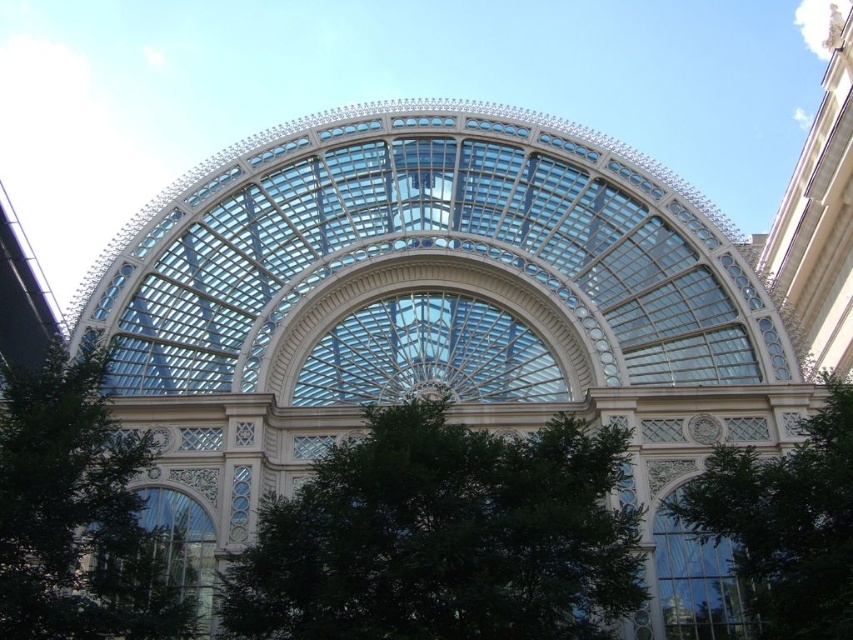
Question: Considering the real-world distances, which object is closest to the green leafy tree at center?

Choices:
 (A) green leafy tree at lower left
 (B) green leafy tree at lower right

Answer: (B)

Question: Does green leafy tree at center appear on the left side of green leafy tree at lower left?

Choices:
 (A) yes
 (B) no

Answer: (B)

Question: Which of the following is the closest to the observer?

Choices:
 (A) green leafy tree at lower right
 (B) green leafy tree at lower left

Answer: (A)

Question: Which object is farther from the camera taking this photo?

Choices:
 (A) green leafy tree at center
 (B) green leafy tree at lower left

Answer: (B)

Question: Is the position of green leafy tree at lower left less distant than that of green leafy tree at lower right?

Choices:
 (A) no
 (B) yes

Answer: (A)

Question: Is green leafy tree at center wider than green leafy tree at lower right?

Choices:
 (A) no
 (B) yes

Answer: (B)